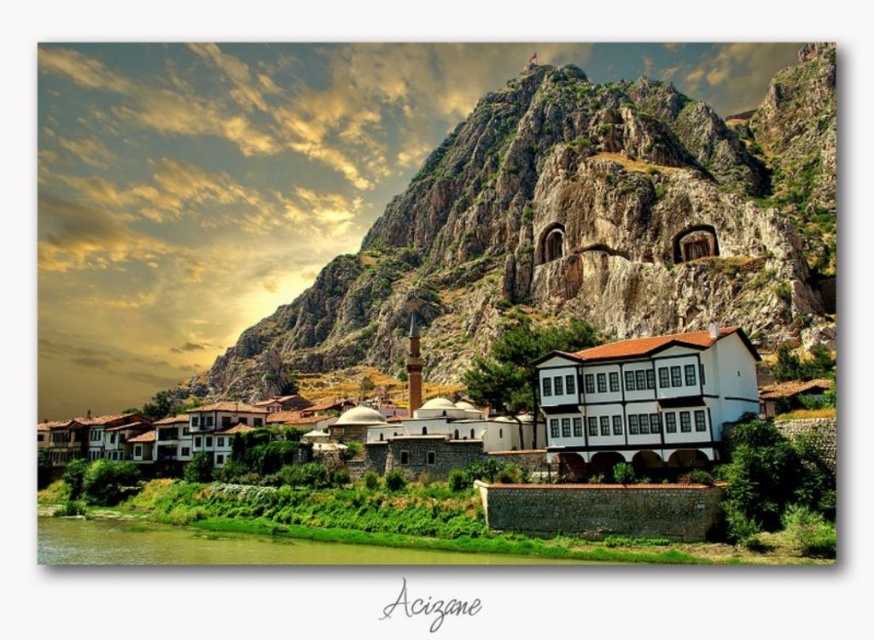
Question: Which point is closer to the camera?

Choices:
 (A) (497, 442)
 (B) (659, 136)

Answer: (A)

Question: Which point is farther to the camera?

Choices:
 (A) white stone building at center
 (B) rugged stone mountain at upper center

Answer: (B)

Question: Does rugged stone mountain at upper center have a larger size compared to white stone building at center?

Choices:
 (A) yes
 (B) no

Answer: (A)

Question: Can you confirm if rugged stone mountain at upper center is smaller than white stone building at center?

Choices:
 (A) yes
 (B) no

Answer: (B)

Question: Does rugged stone mountain at upper center have a smaller size compared to white stone building at center?

Choices:
 (A) yes
 (B) no

Answer: (B)